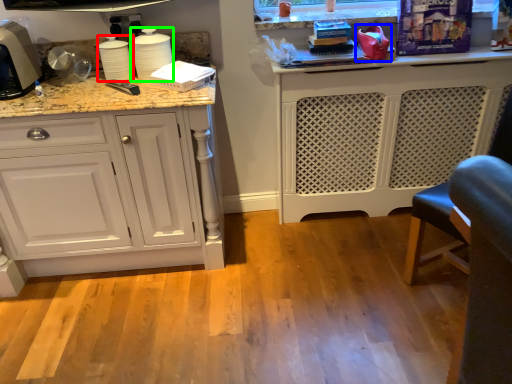
Question: Estimate the real-world distances between objects in this image. Which object is farther from appliance (highlighted by a red box), appliance (highlighted by a blue box) or appliance (highlighted by a green box)?

Choices:
 (A) appliance
 (B) appliance

Answer: (A)